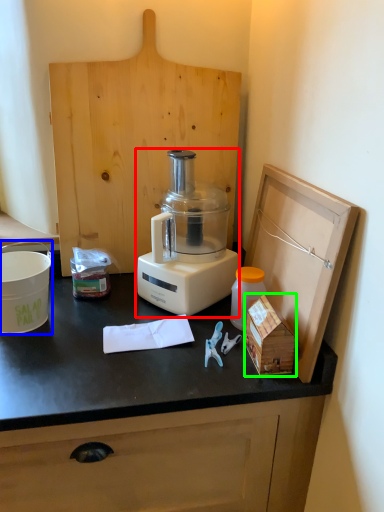
Question: Which object is the closest to the blender (highlighted by a red box)? Choose among these: appliance (highlighted by a blue box) or wood (highlighted by a green box).

Choices:
 (A) appliance
 (B) wood

Answer: (B)